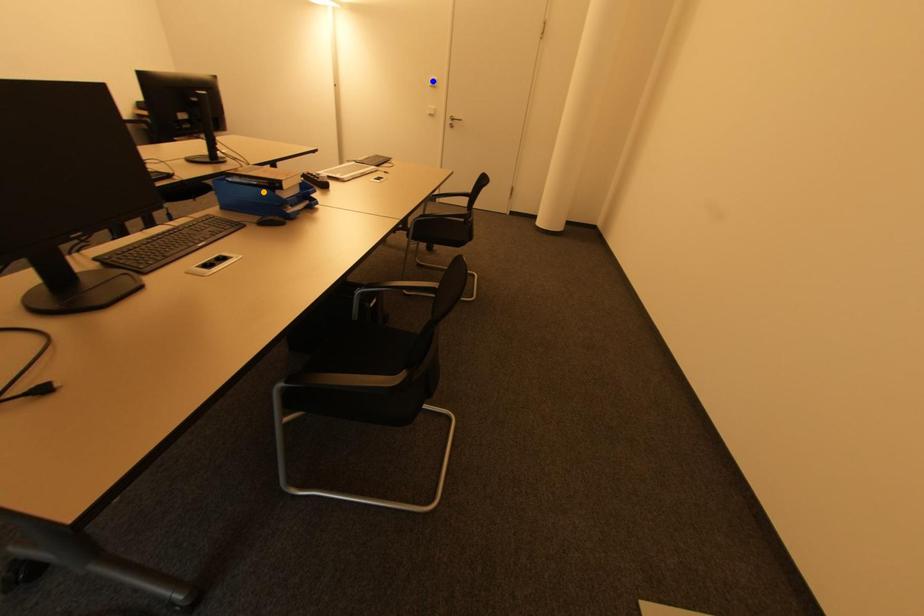
Order these from nearest to farthest:
blue point, red point, orange point

orange point
red point
blue point